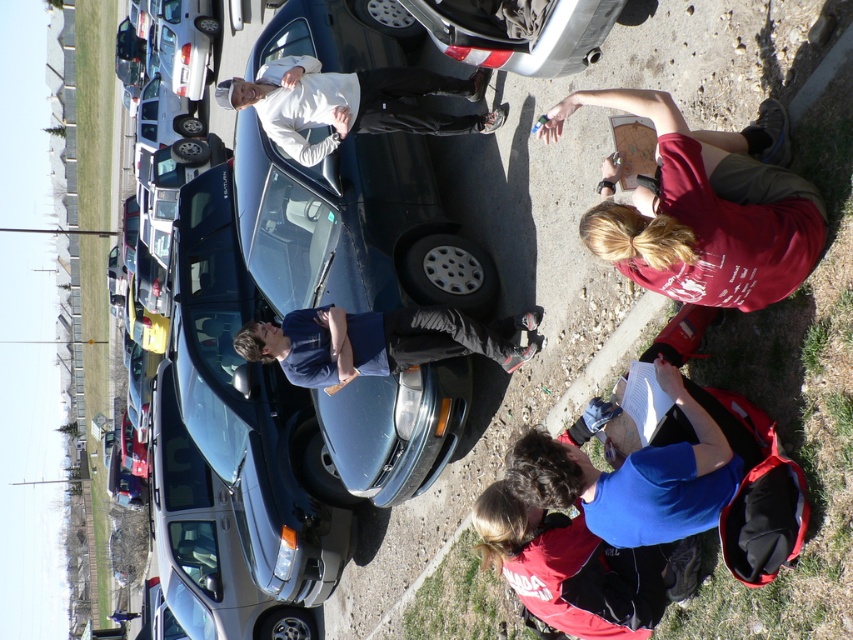
In the scene shown: You are a photographer trying to capture a group photo of the red fabric shirt at lower center and the blue matte shirt at lower right. The minimum focusing distance for your camera is 90 centimeters. Will you be able to take a clear photo of both subjects without moving them?

The red fabric shirt at lower center is 89.34 centimeters away from the blue matte shirt at lower right. Since the distance is less than the camera minimum focusing distance of 90 centimeters, the camera may not focus properly, resulting in a blurry photo. Therefore, you cannot take a clear photo without moving them.

You are standing in the parking lot and want to take a photo of both the matte red shirt at lower right and the white matte shirt at center. Which one should you adjust your camera angle to look up at or down at?

Since the matte red shirt at lower right is below the white matte shirt at center, you should adjust your camera angle to look down at the matte red shirt at lower right and up at the white matte shirt at center to capture both in the frame.